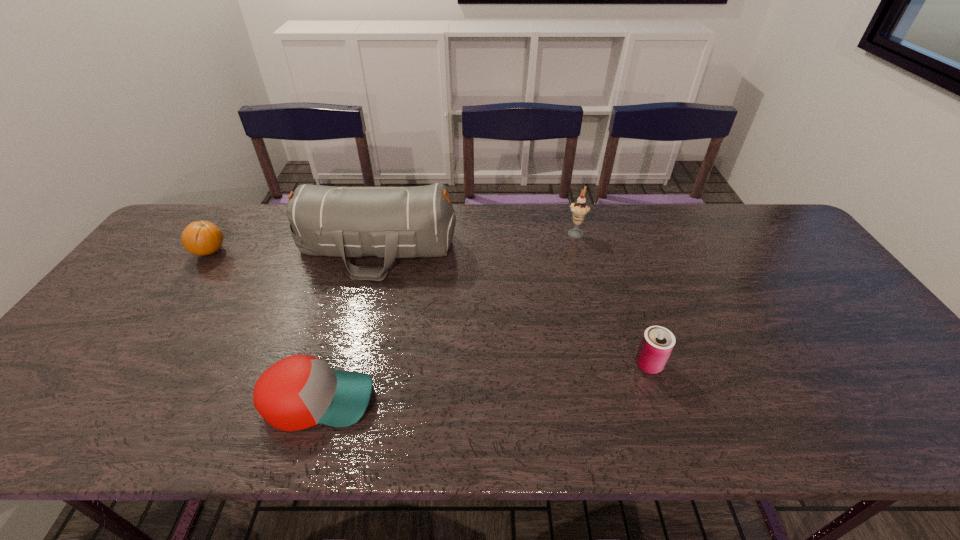
At what (x,y) coordinates should I click in order to perform the action: click on duffel bag. Please return your answer as a coordinate pair (x, y). Image resolution: width=960 pixels, height=540 pixels. Looking at the image, I should click on (388, 222).

The width and height of the screenshot is (960, 540). I want to click on the fourth shortest object, so click(x=580, y=208).

This screenshot has height=540, width=960. Find the location of `the second object from right to left`. the second object from right to left is located at coordinates (580, 208).

Locate an element on the screen. This screenshot has height=540, width=960. orange is located at coordinates (202, 238).

Locate an element on the screen. The width and height of the screenshot is (960, 540). the rightmost object is located at coordinates (657, 343).

Identify the location of baseball cap. This screenshot has width=960, height=540. (300, 391).

The width and height of the screenshot is (960, 540). What are the coordinates of `vacant point located 0.250m on the right of the tallest object` in the screenshot? It's located at (538, 249).

This screenshot has height=540, width=960. Find the location of `free space located 0.330m on the right of the second object from right to left`. free space located 0.330m on the right of the second object from right to left is located at coordinates (687, 232).

I want to click on free location located 0.190m on the back of the orange, so click(241, 207).

Locate an element on the screen. The image size is (960, 540). vacant space situated on the back of the can is located at coordinates (622, 287).